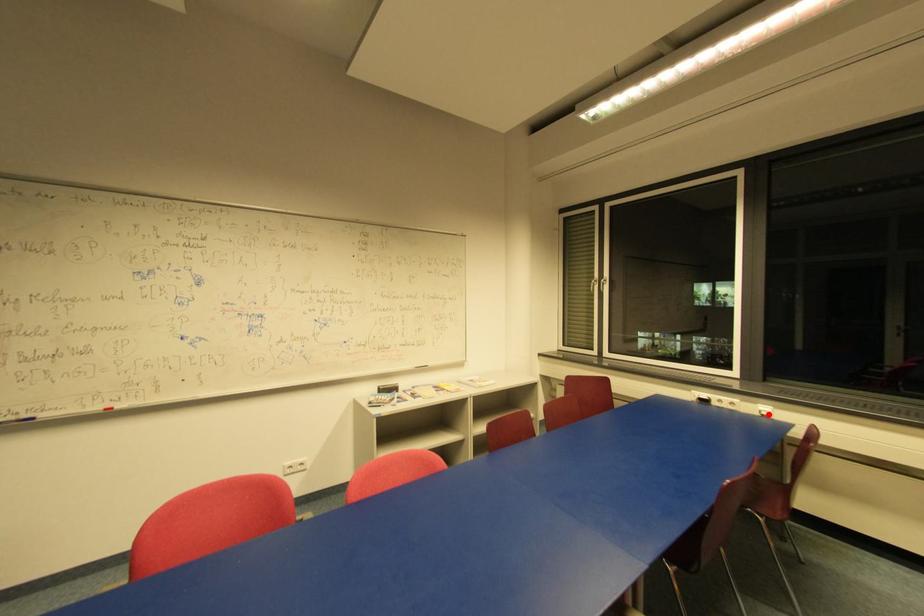
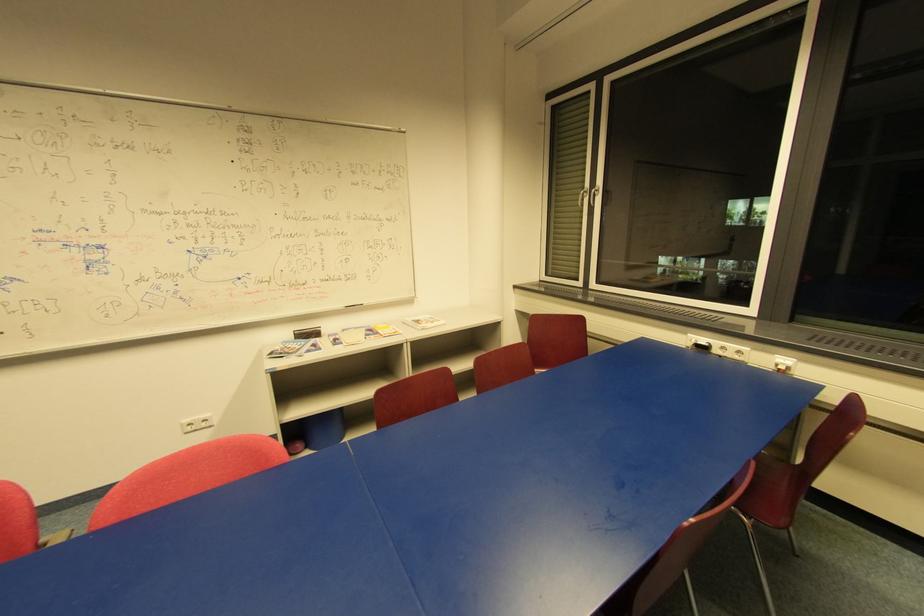
Where in the second image is the point corresponding to the highlighted location from the first image?

(785, 369)